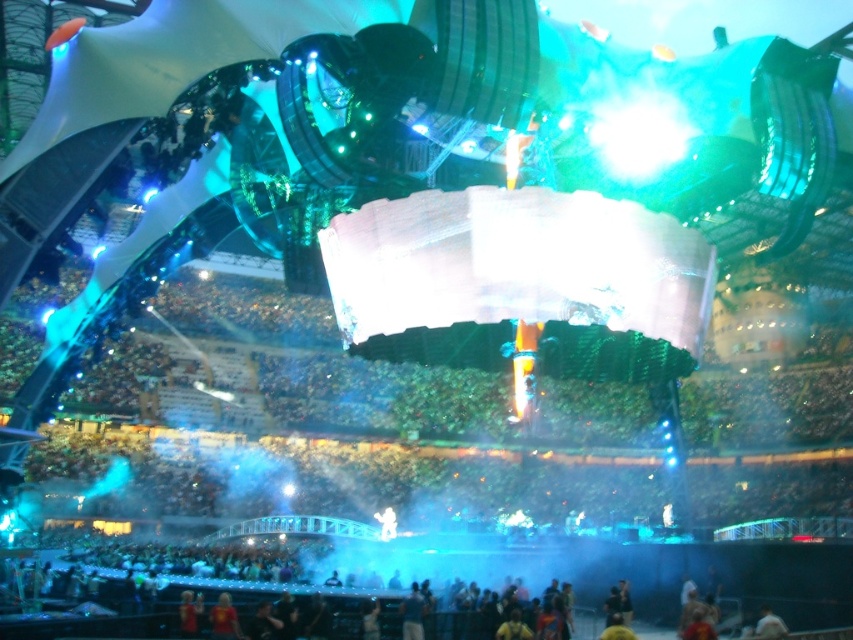
You are a stagehand positioned at the back of the stage. You need to move from your current position to the point marked as point [404,632] and then to point [608,620]. Which point will you reach first?

Since point [404,632] is in front of point [608,620], you will reach point [404,632] first before moving to point [608,620].

You are a stagehand needing to move a 1.5 meter wide equipment cart from the dark blue fabric at lower center to the yellow fabric person at lower center. Can you safely navigate the path between them without any obstacles?

The distance between the dark blue fabric at lower center and the yellow fabric person at lower center is 17.17 meters. Since the equipment cart is only 1.5 meters wide, there is sufficient space to navigate the path safely between them.